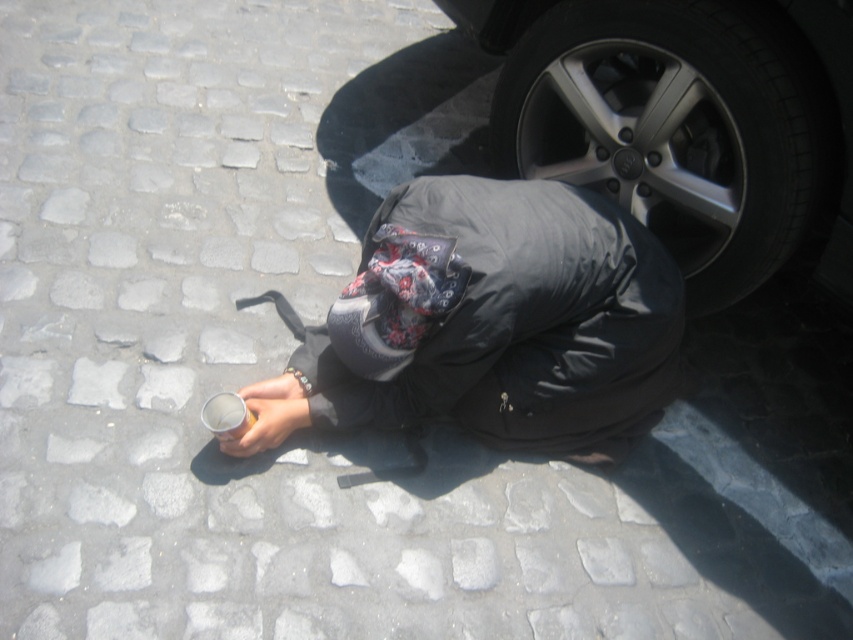
Question: Among these objects, which one is nearest to the camera?

Choices:
 (A) silver metallic tire at lower right
 (B) clear plastic cup at lower left

Answer: (B)

Question: Which point is farther to the camera?

Choices:
 (A) silver metallic tire at lower right
 (B) clear plastic cup at lower left
 (C) metallic can at center

Answer: (A)

Question: Is silver metallic tire at lower right below clear plastic cup at lower left?

Choices:
 (A) no
 (B) yes

Answer: (A)

Question: Which point is farther from the camera taking this photo?

Choices:
 (A) (227, 412)
 (B) (517, 352)

Answer: (B)

Question: Considering the relative positions of metallic can at center and silver metallic tire at lower right in the image provided, where is metallic can at center located with respect to silver metallic tire at lower right?

Choices:
 (A) left
 (B) right

Answer: (A)

Question: Is silver metallic tire at lower right above clear plastic cup at lower left?

Choices:
 (A) yes
 (B) no

Answer: (A)